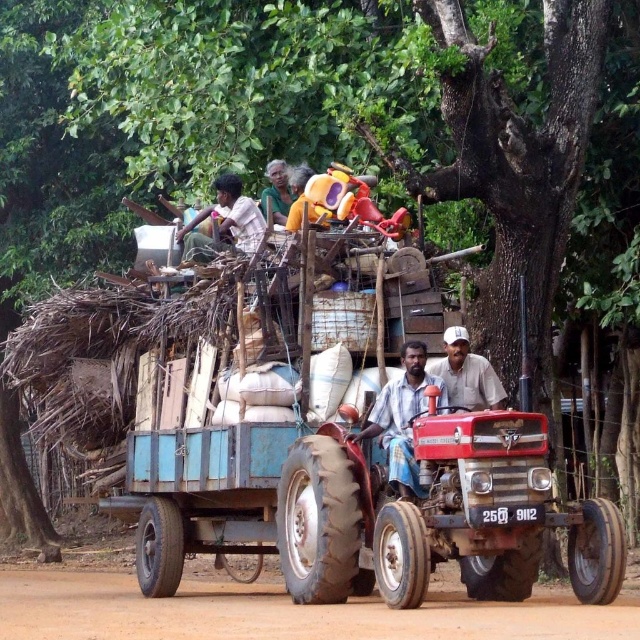
Question: Is brown dirt track at lower center closer to the viewer compared to light brown wooden stick at upper center?

Choices:
 (A) no
 (B) yes

Answer: (B)

Question: Which of the following is the farthest from the observer?

Choices:
 (A) brown dirt track at lower center
 (B) white cotton shirt at center
 (C) light brown fabric shirt at center
 (D) light brown wooden stick at upper center

Answer: (D)

Question: In this image, where is white cotton shirt at center located relative to light brown wooden stick at upper center?

Choices:
 (A) left
 (B) right

Answer: (B)

Question: Which object is closer to the camera taking this photo?

Choices:
 (A) light brown wooden stick at upper center
 (B) brown dirt track at lower center
 (C) light brown fabric shirt at center
 (D) light brown fabric shirt at upper center

Answer: (B)

Question: Which object appears closest to the camera in this image?

Choices:
 (A) light brown fabric shirt at center
 (B) brown dirt track at lower center
 (C) light brown fabric shirt at upper center
 (D) light brown wooden stick at upper center

Answer: (B)

Question: Can you confirm if light brown fabric shirt at center is smaller than white cotton shirt at center?

Choices:
 (A) yes
 (B) no

Answer: (B)